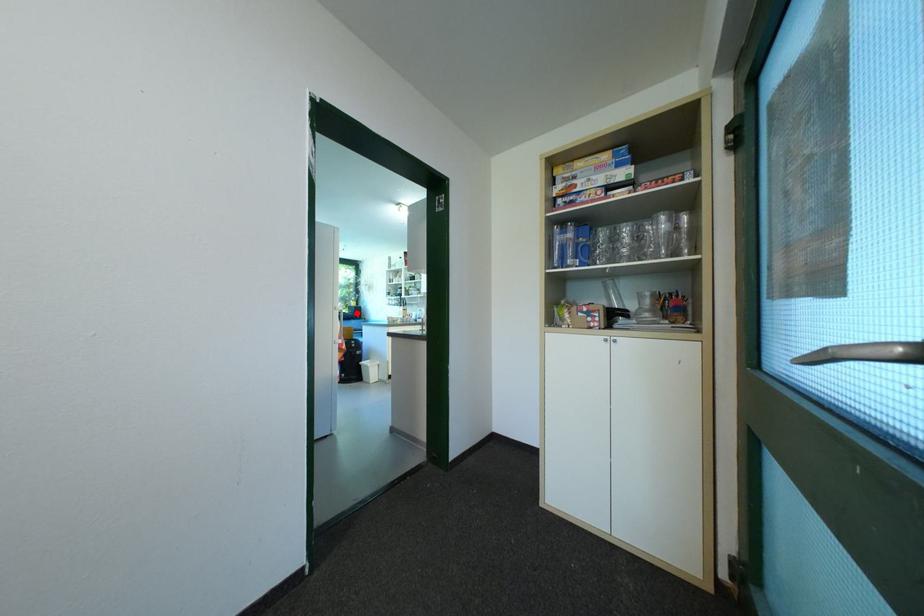
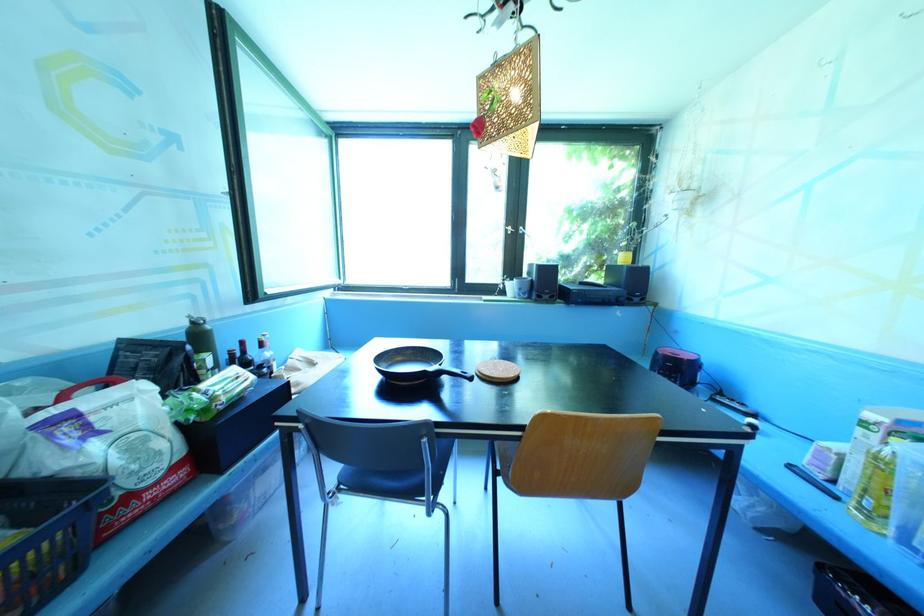
In the second image, find the point that corresponds to the highlighted location in the first image.

(631, 286)